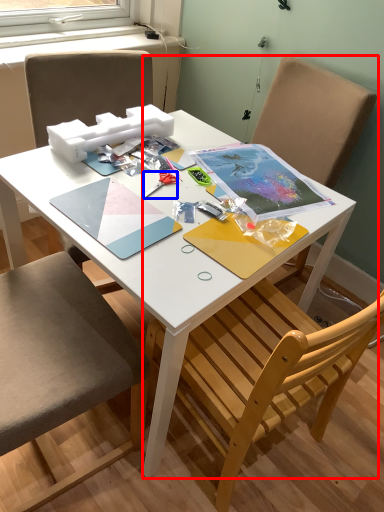
Question: Which object appears farthest to the camera in this image, chair (highlighted by a red box) or scissors (highlighted by a blue box)?

Choices:
 (A) chair
 (B) scissors

Answer: (B)